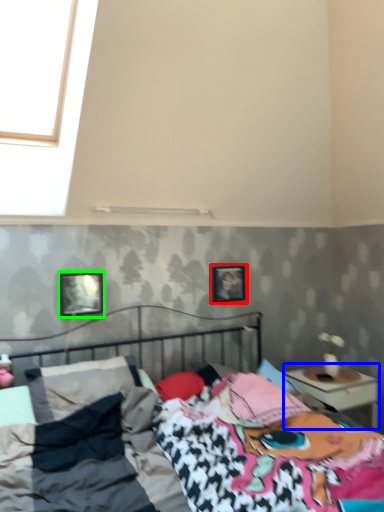
Question: Which is nearer to the picture frame (highlighted by a red box)? nightstand (highlighted by a blue box) or picture frame (highlighted by a green box).

Choices:
 (A) nightstand
 (B) picture frame

Answer: (A)